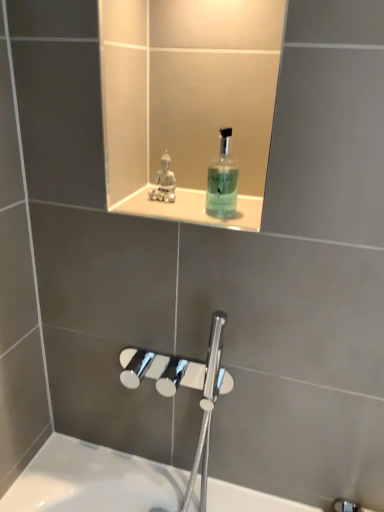
The height and width of the screenshot is (512, 384). What are the coordinates of `vacant area that lies to the right of satin silver statue at upper center` in the screenshot? It's located at [x=219, y=209].